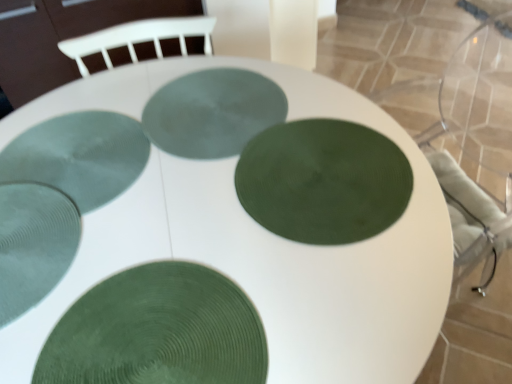
Locate an element on the screen. Image resolution: width=512 pixels, height=384 pixels. free spot above green textured glass plate at center, arranged as the fourth glass plate when viewed from the front (from a real-world perspective) is located at coordinates (70, 157).